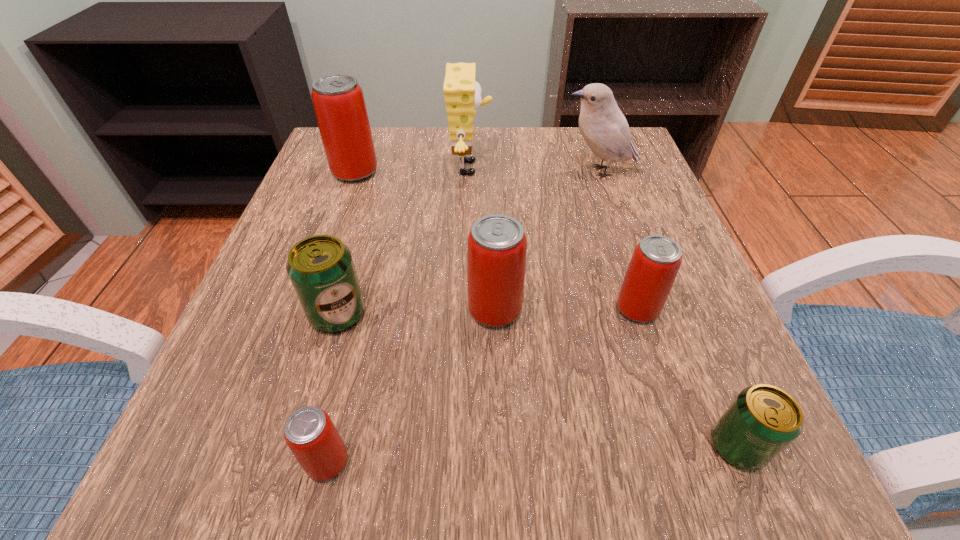
Locate an element on the screen. The width and height of the screenshot is (960, 540). free location located on the front of the left green beer can is located at coordinates (292, 473).

The image size is (960, 540). Identify the location of free space located 0.330m on the back of the rightmost pink beer can. (595, 180).

Where is `vacant region located on the back of the smallest pink beer can`? This screenshot has width=960, height=540. vacant region located on the back of the smallest pink beer can is located at coordinates (361, 322).

This screenshot has height=540, width=960. What are the coordinates of `free space located 0.300m on the back of the nearer green beer can` in the screenshot? It's located at (661, 260).

Where is `sponge that is at the far edge`? sponge that is at the far edge is located at coordinates point(462,94).

Where is `beer can at the far edge`? beer can at the far edge is located at coordinates (338, 100).

Locate an element on the screen. The image size is (960, 540). bird situated at the far edge is located at coordinates (603, 126).

This screenshot has height=540, width=960. Identify the location of bird that is positioned at the right edge. (603, 126).

Find the location of a particular element. The width and height of the screenshot is (960, 540). object present at the far left corner is located at coordinates (338, 100).

This screenshot has height=540, width=960. What are the coordinates of `object that is at the near left corner` in the screenshot? It's located at (310, 434).